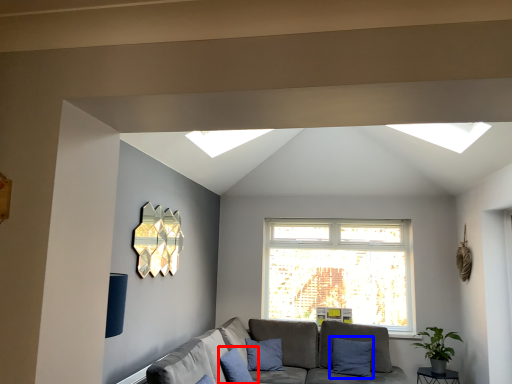
Question: Which point is further to the camera, pillow (highlighted by a red box) or pillow (highlighted by a blue box)?

Choices:
 (A) pillow
 (B) pillow

Answer: (B)